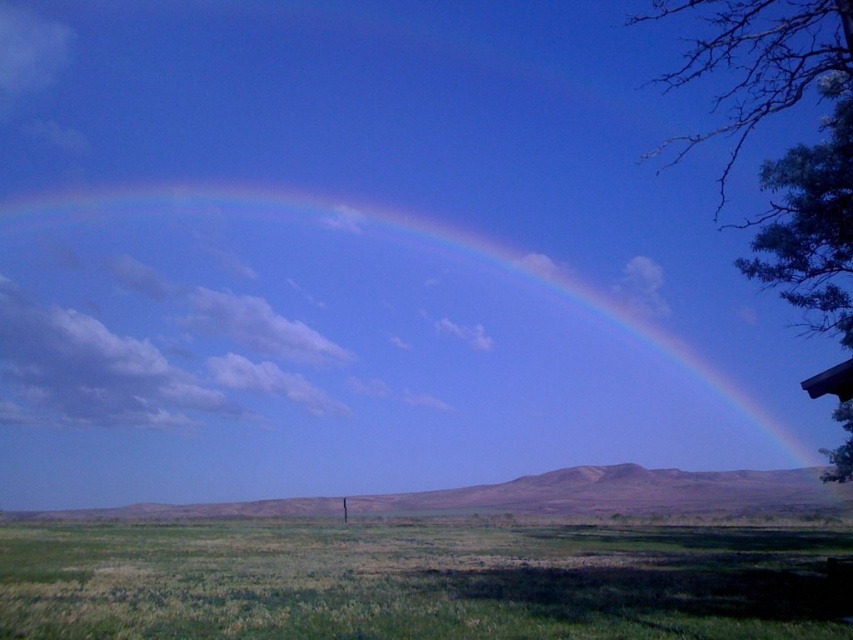
Question: Is rainbow at upper center behind green grassy field at lower center?

Choices:
 (A) yes
 (B) no

Answer: (A)

Question: Among these objects, which one is farthest from the camera?

Choices:
 (A) rainbow at upper center
 (B) green grassy field at lower center

Answer: (A)

Question: Can you confirm if rainbow at upper center is bigger than green grassy field at lower center?

Choices:
 (A) yes
 (B) no

Answer: (A)

Question: From the image, what is the correct spatial relationship of rainbow at upper center in relation to green grassy field at lower center?

Choices:
 (A) below
 (B) above

Answer: (B)

Question: Which of the following is the farthest from the observer?

Choices:
 (A) rainbow at upper center
 (B) green grassy field at lower center

Answer: (A)